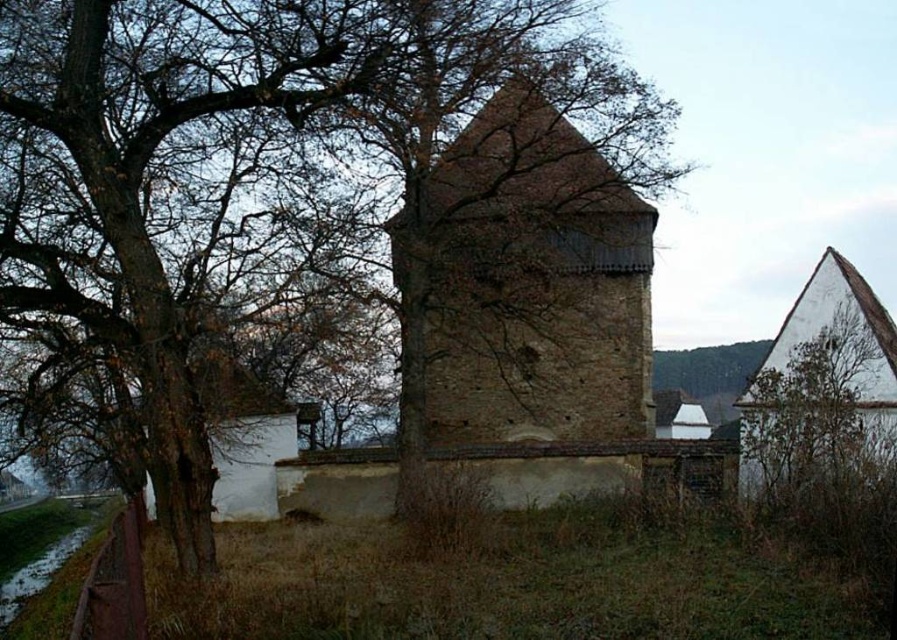
Question: Does brown stone church tower at center come behind white matte tree at right?

Choices:
 (A) no
 (B) yes

Answer: (B)

Question: Which object appears closest to the camera in this image?

Choices:
 (A) white matte tree at right
 (B) brown rough bark tree at center

Answer: (B)

Question: Estimate the real-world distances between objects in this image. Which object is farther from the brown stone church tower at center?

Choices:
 (A) brown rough bark tree at center
 (B) white matte tree at right

Answer: (B)

Question: Which object appears closest to the camera in this image?

Choices:
 (A) white matte tree at right
 (B) brown rough bark tree at center

Answer: (B)

Question: Is brown rough bark tree at center thinner than white matte tree at right?

Choices:
 (A) no
 (B) yes

Answer: (A)

Question: Is brown rough bark tree at center behind brown stone church tower at center?

Choices:
 (A) yes
 (B) no

Answer: (B)